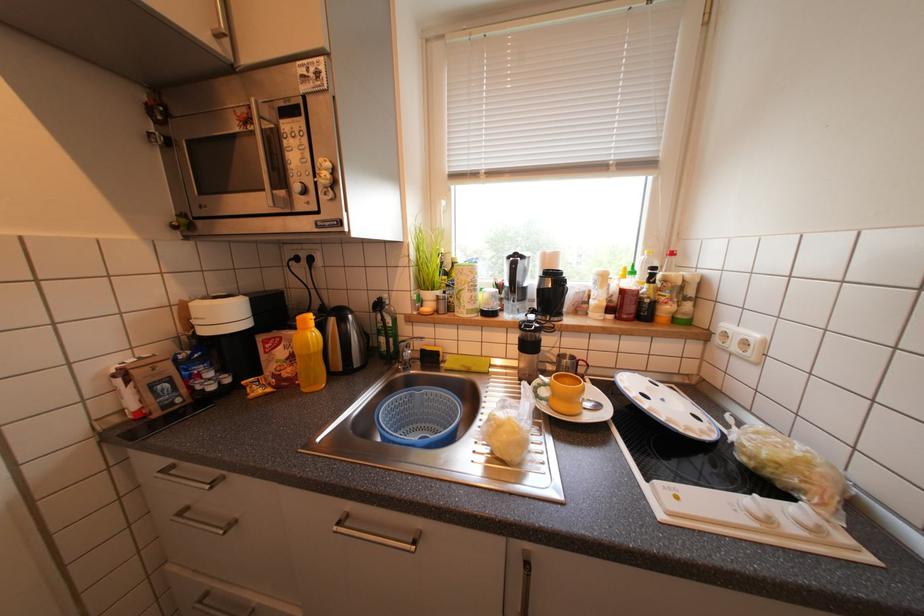
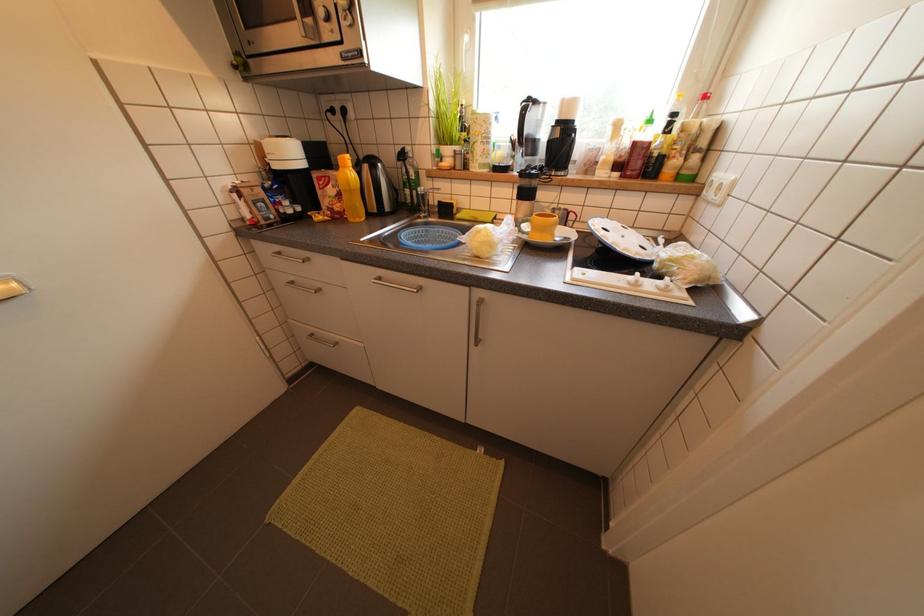
Which direction would the cameraman need to move to produce the second image?

The cameraman moved toward right, backward.